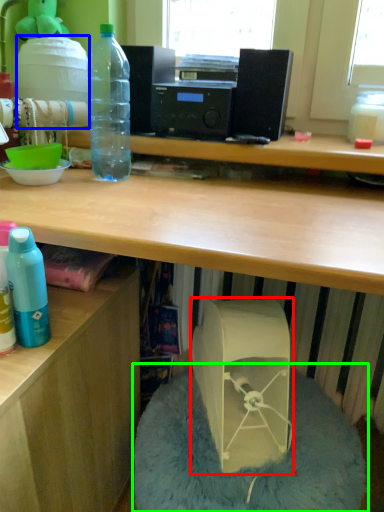
Question: Considering the real-world distances, which object is farthest from wide (highlighted by a red box)? water cooler (highlighted by a blue box) or bean bag chair (highlighted by a green box)?

Choices:
 (A) water cooler
 (B) bean bag chair

Answer: (A)